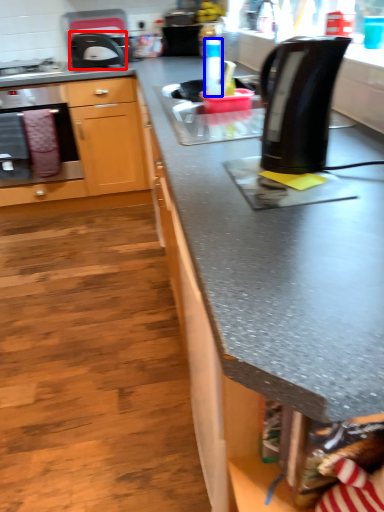
Question: Which object appears closest to the camera in this image, kitchen appliance (highlighted by a red box) or bottle (highlighted by a blue box)?

Choices:
 (A) kitchen appliance
 (B) bottle

Answer: (B)